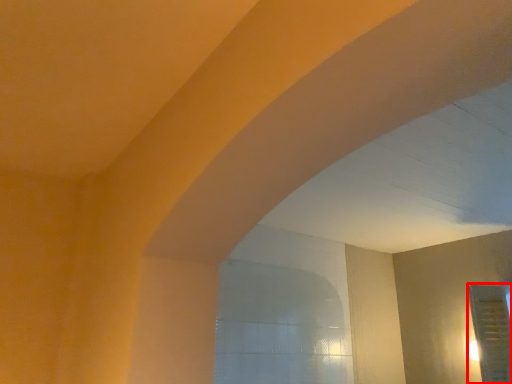
Question: From the image's perspective, where is glass door (annotated by the red box) located relative to window?

Choices:
 (A) below
 (B) above

Answer: (A)